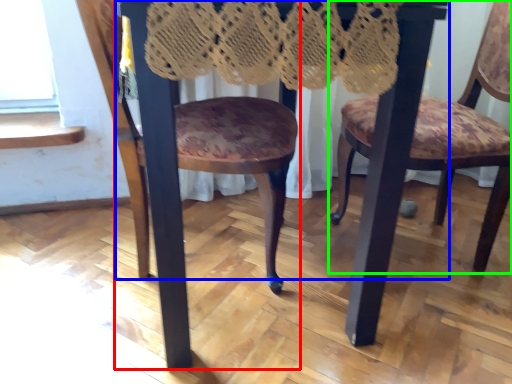
Question: Based on their relative distances, which object is nearer to chair (highlighted by a red box)? Choose from table (highlighted by a blue box) and chair (highlighted by a green box).

Choices:
 (A) table
 (B) chair

Answer: (A)